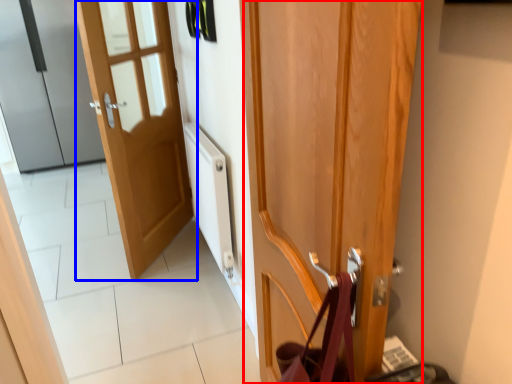
Question: Which point is closer to the camera, door (highlighted by a red box) or door (highlighted by a blue box)?

Choices:
 (A) door
 (B) door

Answer: (A)